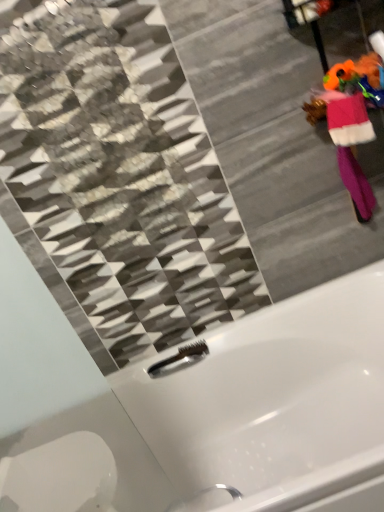
Question: Considering the relative sizes of pink fuzzy robe at right and white glossy bathtub at center in the image provided, is pink fuzzy robe at right shorter than white glossy bathtub at center?

Choices:
 (A) no
 (B) yes

Answer: (B)

Question: Is pink fuzzy robe at right thinner than white glossy bathtub at center?

Choices:
 (A) no
 (B) yes

Answer: (B)

Question: Is pink fuzzy robe at right with white glossy bathtub at center?

Choices:
 (A) no
 (B) yes

Answer: (A)

Question: Is pink fuzzy robe at right taller than white glossy bathtub at center?

Choices:
 (A) yes
 (B) no

Answer: (B)

Question: Is pink fuzzy robe at right at the right side of white glossy bathtub at center?

Choices:
 (A) yes
 (B) no

Answer: (A)

Question: From a real-world perspective, is brushed metal faucet at lower center physically located above or below white glossy bathtub at center?

Choices:
 (A) below
 (B) above

Answer: (B)

Question: Visually, is brushed metal faucet at lower center positioned to the left or to the right of white glossy bathtub at center?

Choices:
 (A) left
 (B) right

Answer: (A)

Question: Is point (198, 342) closer or farther from the camera than point (372, 500)?

Choices:
 (A) farther
 (B) closer

Answer: (A)

Question: Considering the positions of brushed metal faucet at lower center and white glossy bathtub at center in the image, is brushed metal faucet at lower center wider or thinner than white glossy bathtub at center?

Choices:
 (A) wide
 (B) thin

Answer: (B)

Question: Is pink fuzzy robe at right in front of or behind white glossy bathtub at center in the image?

Choices:
 (A) front
 (B) behind

Answer: (B)

Question: Looking at their shapes, would you say pink fuzzy robe at right is wider or thinner than white glossy bathtub at center?

Choices:
 (A) thin
 (B) wide

Answer: (A)

Question: From their relative heights in the image, would you say pink fuzzy robe at right is taller or shorter than white glossy bathtub at center?

Choices:
 (A) tall
 (B) short

Answer: (B)

Question: Would you say pink fuzzy robe at right is to the left or to the right of white glossy bathtub at center in the picture?

Choices:
 (A) left
 (B) right

Answer: (B)

Question: Which is correct: white glossy bathtub at center is inside pink fuzzy robe at right, or outside of it?

Choices:
 (A) inside
 (B) outside

Answer: (B)

Question: Based on their sizes in the image, would you say white glossy bathtub at center is bigger or smaller than pink fuzzy robe at right?

Choices:
 (A) big
 (B) small

Answer: (A)